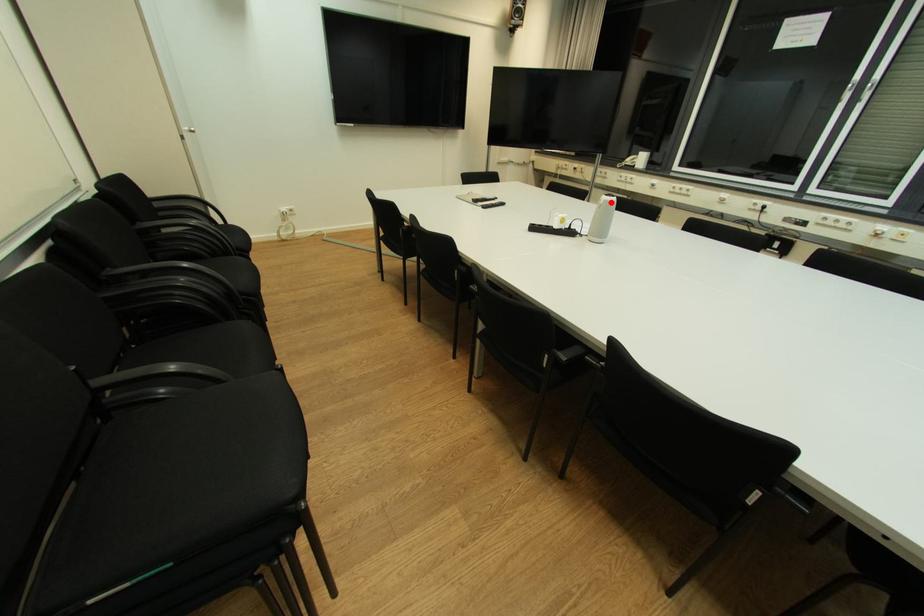
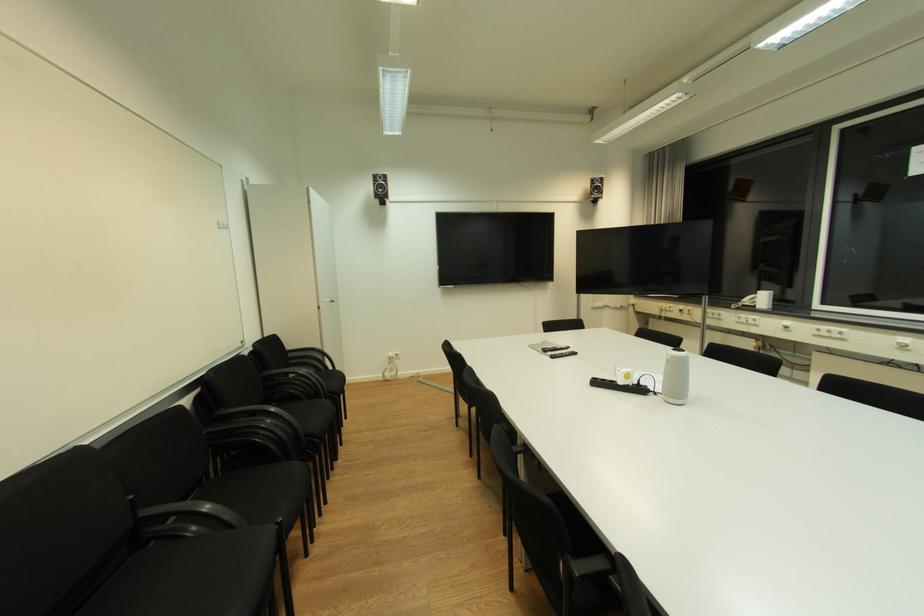
The point at the highlighted location is marked in the first image. Where is the corresponding point in the second image?

(678, 358)